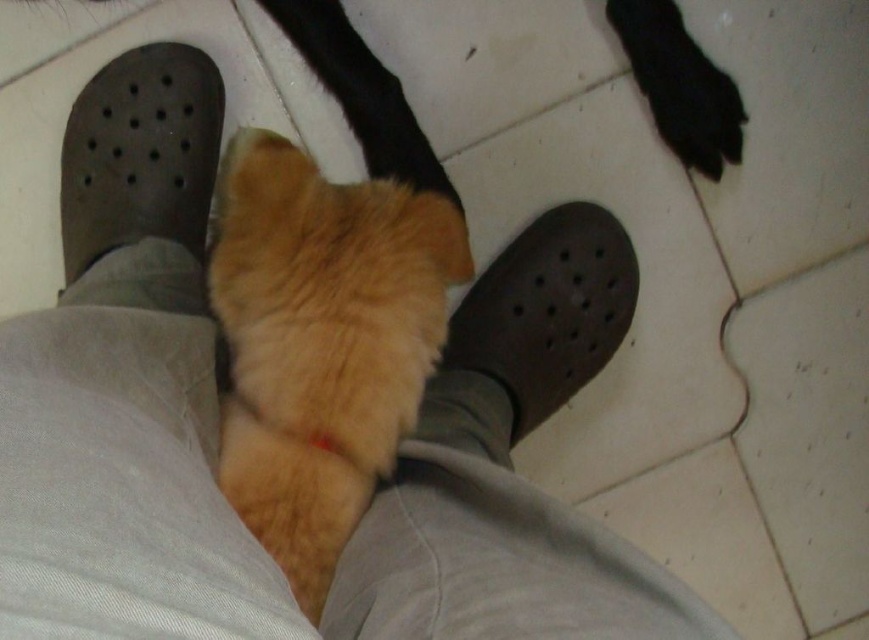
In the scene shown: Does dark grey rubber shoe at left come in front of brown rubber shoe at center?

No, it is not.

Does dark grey rubber shoe at left have a greater height compared to brown rubber shoe at center?

In fact, dark grey rubber shoe at left may be shorter than brown rubber shoe at center.

Between point (151, 106) and point (559, 250), which one is positioned in front?

Positioned in front is point (151, 106).

Identify the location of dark grey rubber shoe at left. (140, 154).

Who is higher up, fuzzy orange cat at center or dark grey rubber shoe at left?

dark grey rubber shoe at left

Who is taller, fuzzy orange cat at center or dark grey rubber shoe at left?

With more height is fuzzy orange cat at center.

Who is more forward, (357,509) or (70,224)?

Point (357,509) is in front.

Find the location of a particular element. fuzzy orange cat at center is located at coordinates click(322, 342).

This screenshot has width=869, height=640. I want to click on fuzzy orange cat at center, so click(322, 342).

I want to click on fuzzy orange cat at center, so click(322, 342).